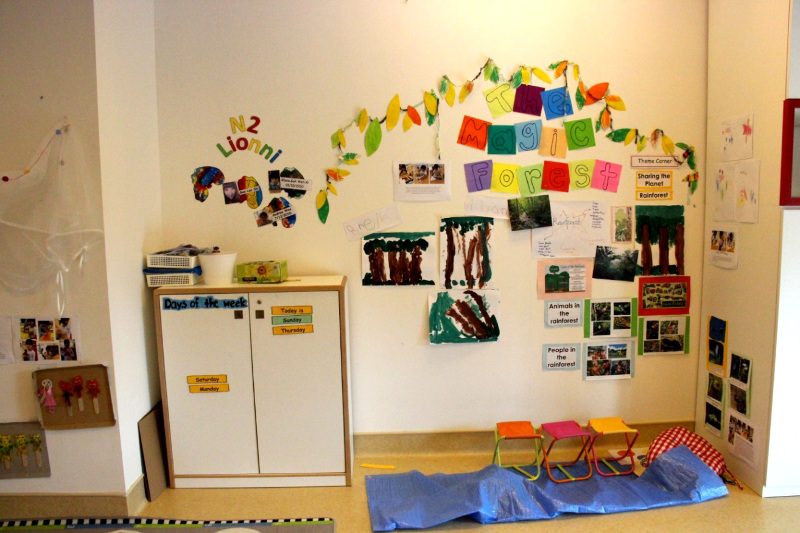
Find the location of a particular element. poster is located at coordinates (412, 293), (649, 249), (662, 253), (668, 268).